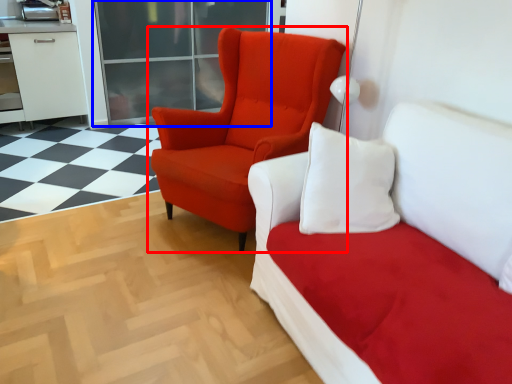
Question: Which object is closer to the camera taking this photo, chair (highlighted by a red box) or glass door (highlighted by a blue box)?

Choices:
 (A) chair
 (B) glass door

Answer: (A)